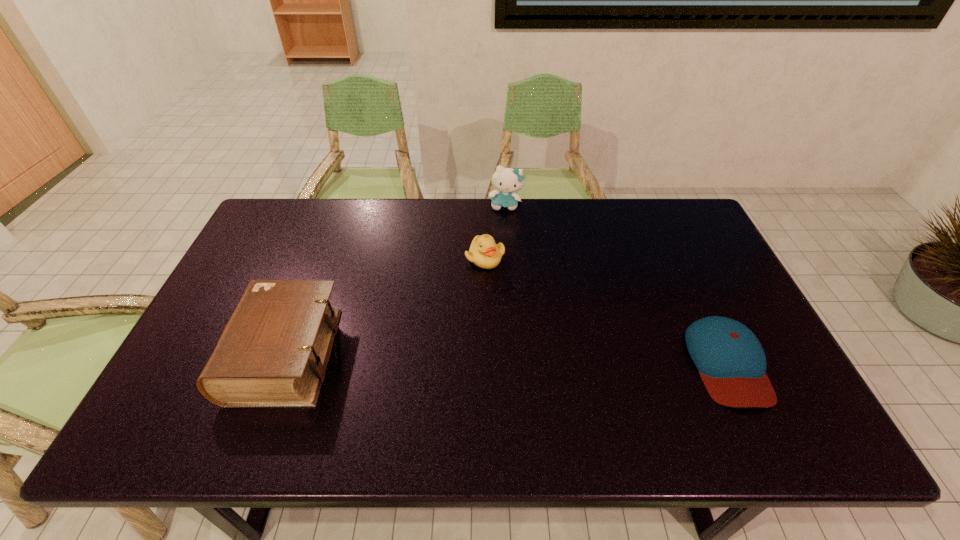
Identify the location of the third shortest object. (273, 352).

You are a GUI agent. You are given a task and a screenshot of the screen. Output one action in this format:
    pyautogui.click(x=<x>, y=<y>)
    Task: Click on the Bible
    The image size is (960, 540).
    Given the screenshot: What is the action you would take?
    pyautogui.click(x=273, y=352)

Identify the location of the rightmost object. The image size is (960, 540). (731, 362).

Where is `the shortest object`? This screenshot has width=960, height=540. the shortest object is located at coordinates (731, 362).

Locate an element on the screen. duckling is located at coordinates (484, 252).

Where is `the third tallest object`? This screenshot has height=540, width=960. the third tallest object is located at coordinates (484, 252).

Where is `the farthest object`? This screenshot has width=960, height=540. the farthest object is located at coordinates (506, 180).

Locate an element on the screen. the tallest object is located at coordinates (506, 180).

Locate an element on the screen. vacant area situated on the spine side of the leftmost object is located at coordinates (194, 355).

Where is `vacant position located on the spine side of the leftmost object`? The height and width of the screenshot is (540, 960). vacant position located on the spine side of the leftmost object is located at coordinates (189, 355).